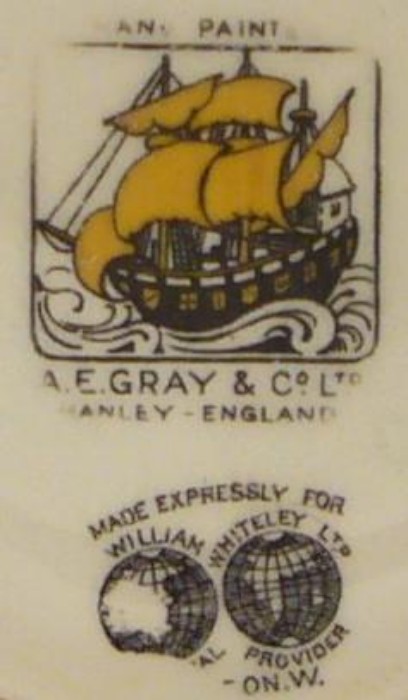
Locate an element on the screen. ship cabin is located at coordinates (324, 206).